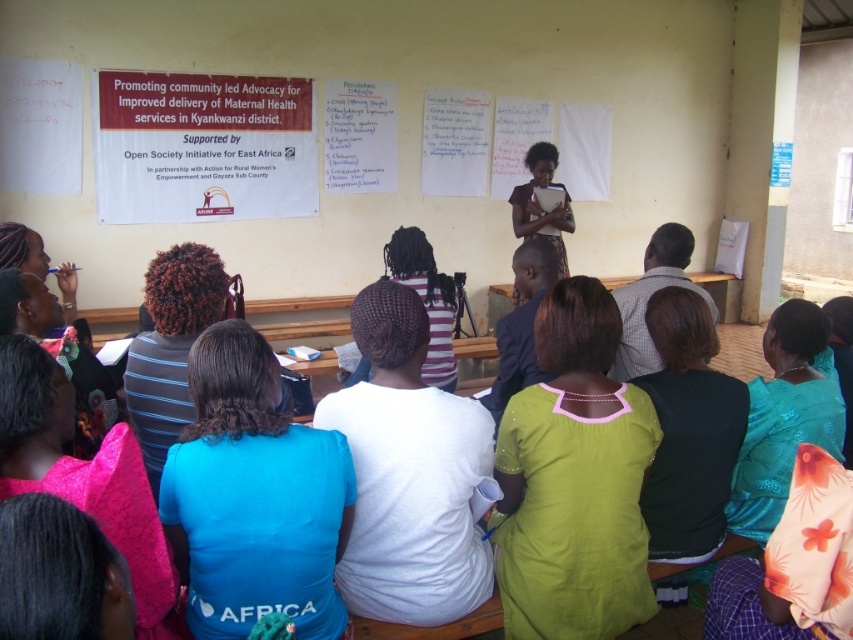
Question: Can you confirm if teal satin dress at lower right is positioned below checkered fabric shirt at center?

Choices:
 (A) yes
 (B) no

Answer: (A)

Question: Is blue fabric shirt at center wider than braided hair at center?

Choices:
 (A) no
 (B) yes

Answer: (B)

Question: Which is farther from the dark brown curly hair at center?

Choices:
 (A) white matte shirt at center
 (B) braided hair at center
 (C) teal satin dress at lower right

Answer: (C)

Question: Considering the relative positions of green fabric dress at center and white matte shirt at center in the image provided, where is green fabric dress at center located with respect to white matte shirt at center?

Choices:
 (A) above
 (B) below

Answer: (B)

Question: Which point is farther to the camera?

Choices:
 (A) (746, 470)
 (B) (125, 468)
 (C) (97, 419)
 (D) (434, 579)

Answer: (A)

Question: Which object is the closest to the dark brown curly hair at center?

Choices:
 (A) teal satin dress at lower right
 (B) white matte shirt at center
 (C) matte blue shirt at upper left
 (D) checkered fabric shirt at center

Answer: (C)